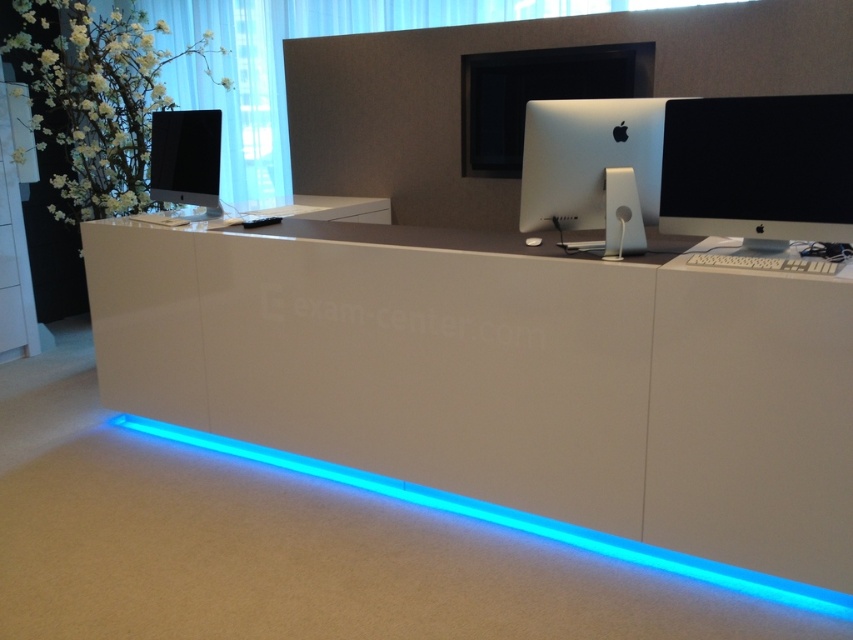
Question: Can you confirm if blue led strip at lower center is positioned to the right of matte black monitor at left?

Choices:
 (A) yes
 (B) no

Answer: (A)

Question: Which point appears closest to the camera in this image?

Choices:
 (A) (575, 116)
 (B) (265, 464)
 (C) (764, 192)

Answer: (C)

Question: Is the position of white glossy desk at center more distant than that of blue led strip at lower center?

Choices:
 (A) no
 (B) yes

Answer: (A)

Question: Which point is farther to the camera?

Choices:
 (A) blue led strip at lower center
 (B) matte black monitor at left
 (C) sleek silver imac at center

Answer: (B)

Question: Estimate the real-world distances between objects in this image. Which object is closer to the sleek silver imac at center?

Choices:
 (A) black glossy monitor at right
 (B) blue led strip at lower center
 (C) matte black monitor at left

Answer: (A)

Question: Observing the image, what is the correct spatial positioning of white glossy desk at center in reference to black glossy monitor at right?

Choices:
 (A) right
 (B) left

Answer: (B)